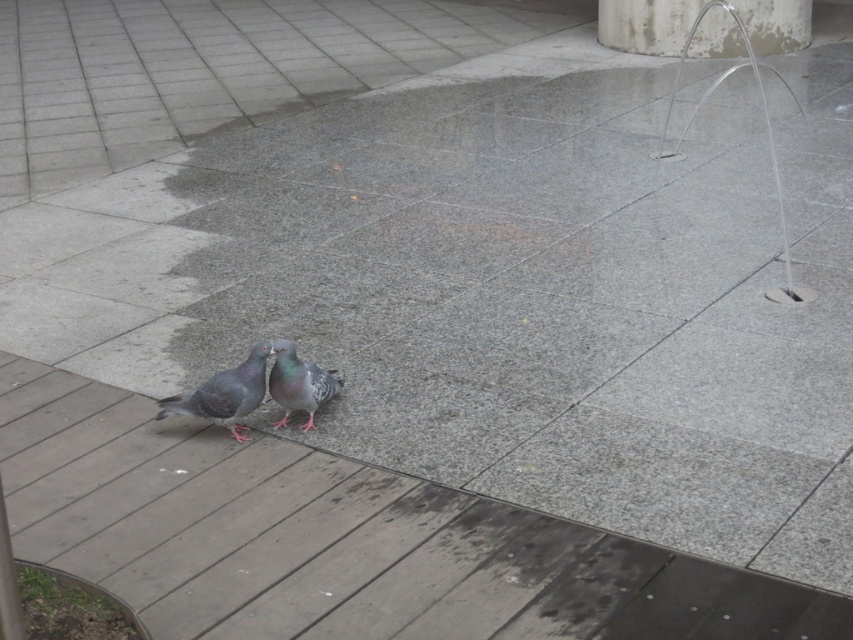
Question: Which point is closer to the camera?

Choices:
 (A) (640, 38)
 (B) (314, 406)
 (C) (155, 417)

Answer: (C)

Question: Observing the image, what is the correct spatial positioning of white concrete pillar at upper right in reference to gray matte pigeon at center?

Choices:
 (A) right
 (B) left

Answer: (A)

Question: Does white concrete pillar at upper right appear on the right side of gray matte pigeon at center?

Choices:
 (A) yes
 (B) no

Answer: (A)

Question: Among these points, which one is nearest to the camera?

Choices:
 (A) (804, 42)
 (B) (281, 349)
 (C) (216, 390)

Answer: (B)

Question: Which of the following is the closest to the observer?

Choices:
 (A) (807, 12)
 (B) (160, 404)

Answer: (B)

Question: Can you confirm if white concrete pillar at upper right is bigger than gray matte pigeon at center?

Choices:
 (A) no
 (B) yes

Answer: (B)